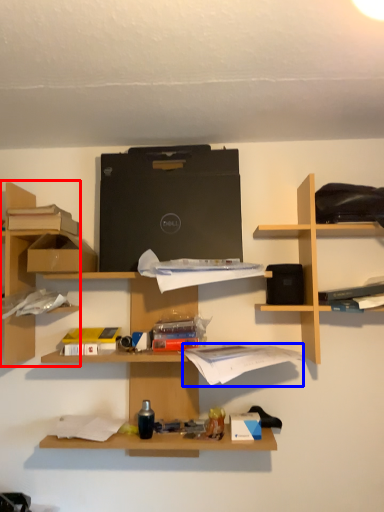
Question: Among these objects, which one is nearest to the camera, shelf (highlighted by a red box) or book (highlighted by a blue box)?

Choices:
 (A) shelf
 (B) book

Answer: (B)